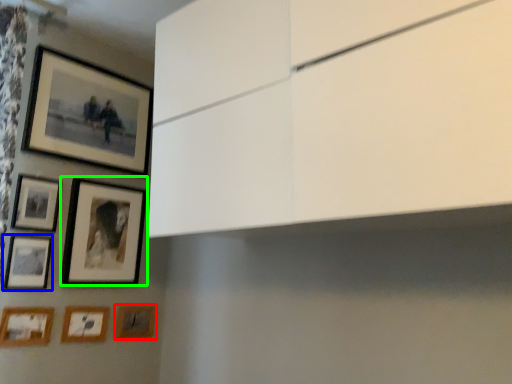
Question: Estimate the real-world distances between objects in this image. Which object is farther from picture frame (highlighted by a red box), picture frame (highlighted by a blue box) or picture frame (highlighted by a green box)?

Choices:
 (A) picture frame
 (B) picture frame

Answer: (A)